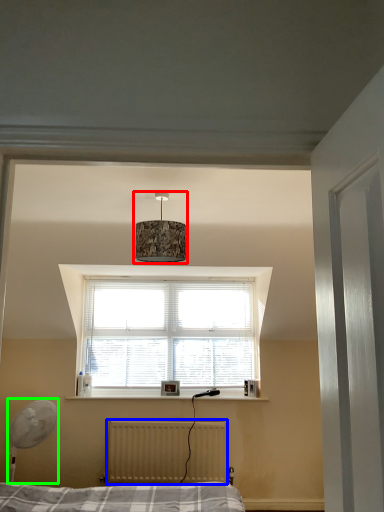
Question: Estimate the real-world distances between objects in this image. Which object is closer to lamp (highlighted by a red box), radiator (highlighted by a blue box) or table lamp (highlighted by a green box)?

Choices:
 (A) radiator
 (B) table lamp

Answer: (B)